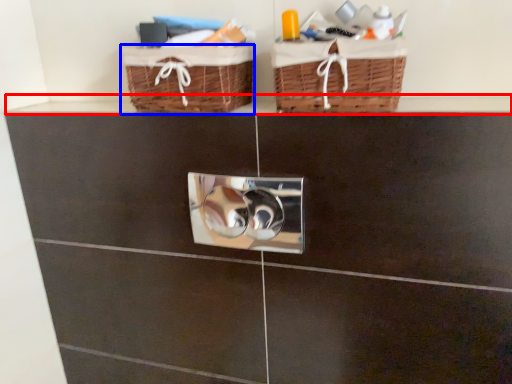
Question: Which of the following is the closest to the observer, ledge (highlighted by a red box) or basket (highlighted by a blue box)?

Choices:
 (A) ledge
 (B) basket

Answer: (A)